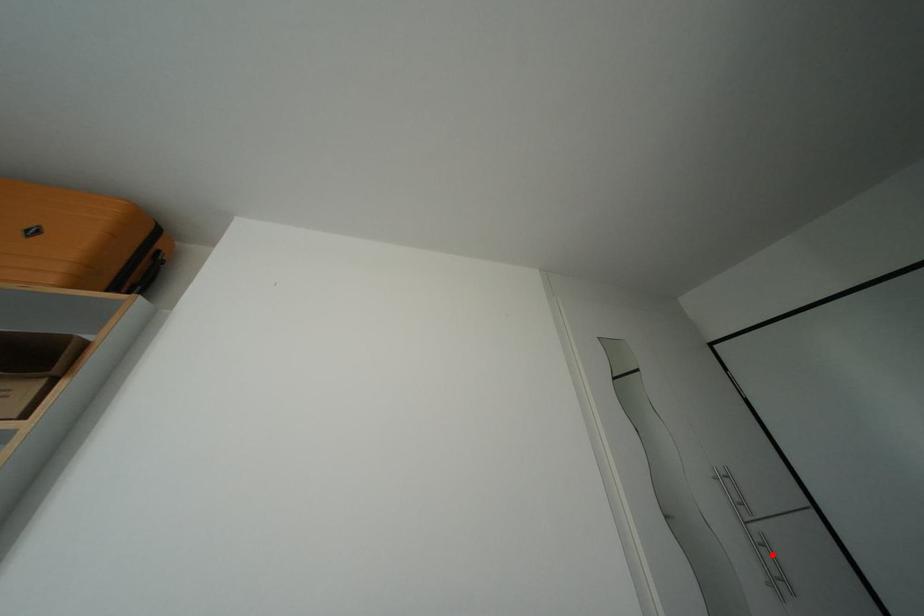
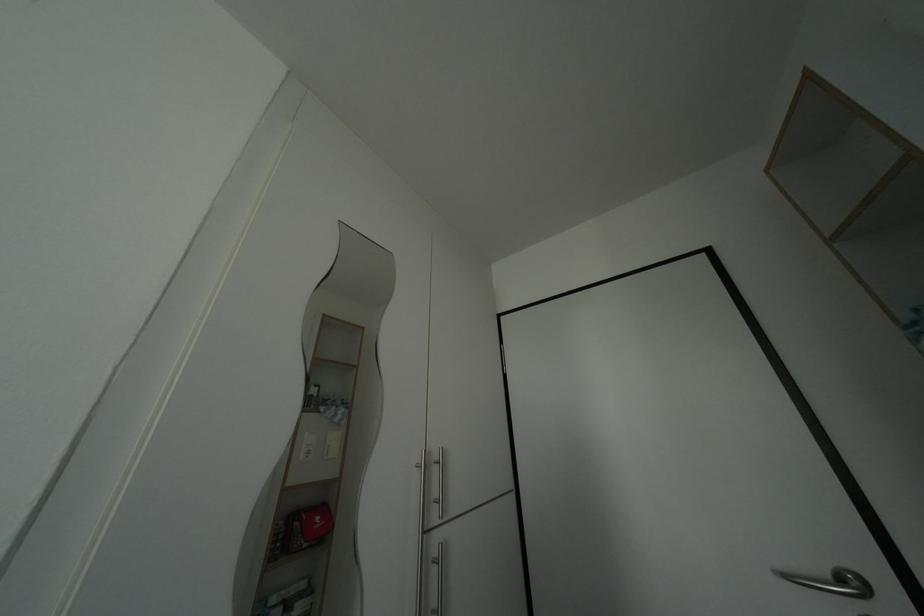
Question: I am providing you with two images of the same scene from different viewpoints. In image1, a red point is highlighted. Considering the same 3D point in image2, which of the following is correct?

Choices:
 (A) It is closer
 (B) It is farther

Answer: (B)